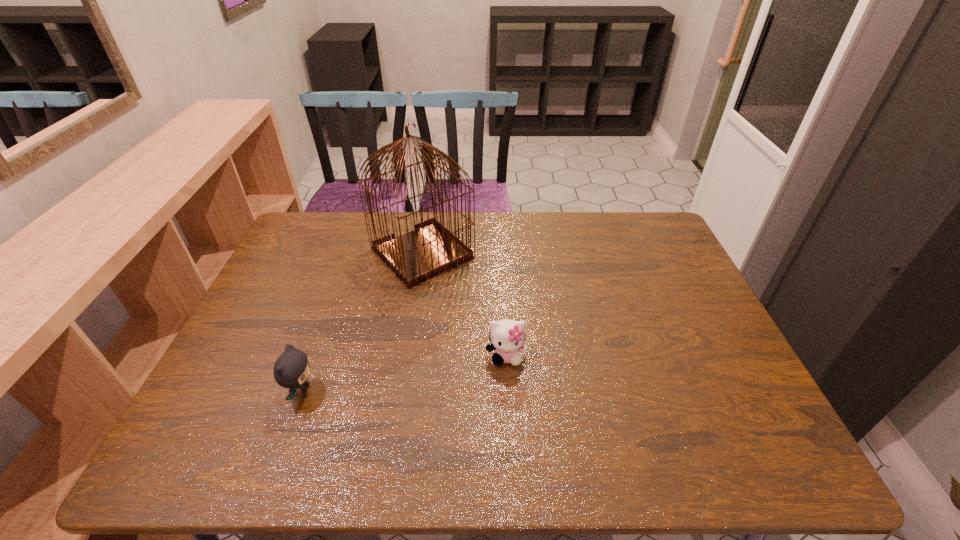
The width and height of the screenshot is (960, 540). I want to click on empty space between the birdcage and the leftmost object, so click(362, 322).

I want to click on unoccupied area between the left kitten and the second object from left to right, so click(x=362, y=322).

Identify which object is the second nearest to the rightmost object. Please provide its 2D coordinates. Your answer should be formatted as a tuple, i.e. [(x, y)], where the tuple contains the x and y coordinates of a point satisfying the conditions above.

[(291, 370)]

Identify which object is the second closest to the birdcage. Please provide its 2D coordinates. Your answer should be formatted as a tuple, i.e. [(x, y)], where the tuple contains the x and y coordinates of a point satisfying the conditions above.

[(291, 370)]

Locate an element on the screen. The image size is (960, 540). free spot that satisfies the following two spatial constraints: 1. on the front-facing side of the rightmost object; 2. on the front-facing side of the leftmost object is located at coordinates (508, 391).

You are a GUI agent. You are given a task and a screenshot of the screen. Output one action in this format:
    pyautogui.click(x=<x>, y=<y>)
    Task: Click on the free spot that satisfies the following two spatial constraints: 1. on the front-facing side of the right kitten; 2. on the front-facing side of the leftmost object
    The image size is (960, 540).
    Given the screenshot: What is the action you would take?
    pyautogui.click(x=508, y=391)

This screenshot has width=960, height=540. Find the location of `free region that satisfies the following two spatial constraints: 1. on the front-facing side of the right kitten; 2. on the front-facing side of the leftmost object`. free region that satisfies the following two spatial constraints: 1. on the front-facing side of the right kitten; 2. on the front-facing side of the leftmost object is located at coordinates (508, 391).

At what (x,y) coordinates should I click in order to perform the action: click on vacant space that satisfies the following two spatial constraints: 1. on the front-facing side of the rightmost object; 2. on the front-facing side of the left kitten. Please return your answer as a coordinate pair (x, y). The height and width of the screenshot is (540, 960). Looking at the image, I should click on (508, 391).

The width and height of the screenshot is (960, 540). Find the location of `blank area in the image that satisfies the following two spatial constraints: 1. on the front-facing side of the right kitten; 2. on the front-facing side of the leftmost object`. blank area in the image that satisfies the following two spatial constraints: 1. on the front-facing side of the right kitten; 2. on the front-facing side of the leftmost object is located at coordinates (508, 391).